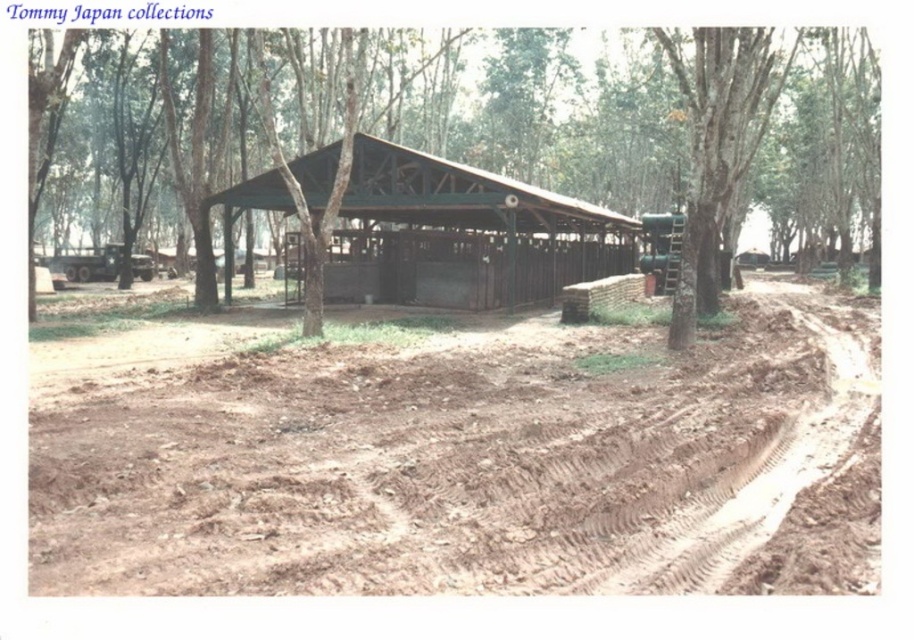
Between point (102, 97) and point (399, 244), which one is positioned behind?

The point (102, 97) is behind.

The height and width of the screenshot is (640, 914). Identify the location of green wood tree at center. (569, 116).

Is green metal hut at center to the left of green rough bark tree at center from the viewer's perspective?

Correct, you'll find green metal hut at center to the left of green rough bark tree at center.

Between green metal hut at center and green rough bark tree at center, which one has more height?

Standing taller between the two is green rough bark tree at center.

Between point (375, 186) and point (715, 148), which one is positioned in front?

Point (715, 148) is more forward.

The height and width of the screenshot is (640, 914). I want to click on green metal hut at center, so click(479, 227).

Can you confirm if brown soil at center is positioned below green wood tree at center?

Indeed, brown soil at center is positioned under green wood tree at center.

Who is more distant from viewer, (449, 509) or (746, 212)?

Positioned behind is point (746, 212).

At what (x,y) coordinates should I click in order to perform the action: click on brown soil at center. Please return your answer as a coordinate pair (x, y). This screenshot has height=640, width=914. Looking at the image, I should click on (458, 461).